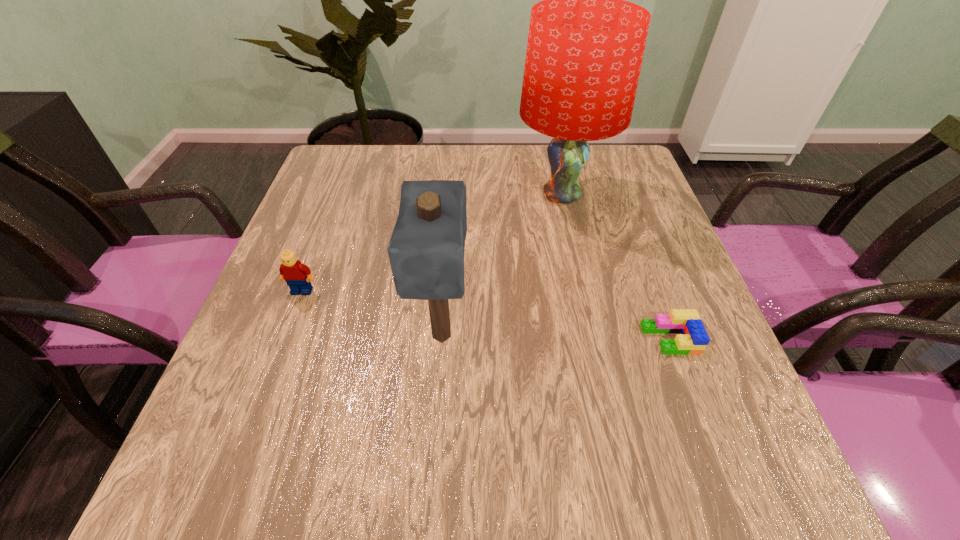
I want to click on free spot between the third object from right to left and the tallest object, so click(x=502, y=265).

Locate an element on the screen. Image resolution: width=960 pixels, height=540 pixels. unoccupied area between the tallest object and the second tallest object is located at coordinates (502, 265).

The width and height of the screenshot is (960, 540). In order to click on vacant area that lies between the farthest object and the second tallest object in this screenshot , I will do (502, 265).

Point out which object is positioned as the second nearest to the third object from right to left. Please provide its 2D coordinates. Your answer should be formatted as a tuple, i.e. [(x, y)], where the tuple contains the x and y coordinates of a point satisfying the conditions above.

[(585, 48)]

Select which object appears as the third closest to the lampshade. Please provide its 2D coordinates. Your answer should be formatted as a tuple, i.e. [(x, y)], where the tuple contains the x and y coordinates of a point satisfying the conditions above.

[(292, 271)]

Identify the location of free location that satisfies the following two spatial constraints: 1. on the front-facing side of the shorter Lego; 2. on the right side of the farther Lego. (284, 339).

Find the location of a particular element. Image resolution: width=960 pixels, height=540 pixels. free region that satisfies the following two spatial constraints: 1. on the front-facing side of the right Lego; 2. on the right side of the lampshade is located at coordinates 593,339.

Where is `free point that satisfies the following two spatial constraints: 1. on the front-facing side of the farthest object; 2. on the right side of the right Lego`? This screenshot has width=960, height=540. free point that satisfies the following two spatial constraints: 1. on the front-facing side of the farthest object; 2. on the right side of the right Lego is located at coordinates (593, 339).

Image resolution: width=960 pixels, height=540 pixels. I want to click on vacant point that satisfies the following two spatial constraints: 1. on the front-facing side of the left Lego; 2. on the right side of the mallet, so click(x=285, y=335).